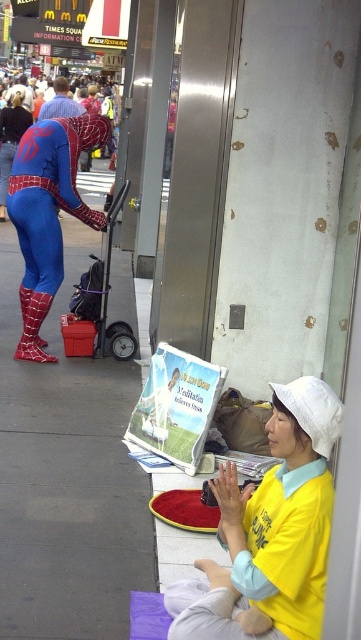
Question: Which object is positioned farthest from the blue spandex suit at left?

Choices:
 (A) matte paper comic book at lower center
 (B) yellow fabric shirt at lower right
 (C) shiny spandex suit at left

Answer: (B)

Question: Considering the relative positions of yellow fabric shirt at lower right and blue spandex suit at left in the image provided, where is yellow fabric shirt at lower right located with respect to blue spandex suit at left?

Choices:
 (A) above
 (B) below

Answer: (B)

Question: Which object is positioned closest to the blue spandex suit at left?

Choices:
 (A) shiny spandex suit at left
 (B) yellow fabric shirt at lower right
 (C) concrete sidewalk at lower left
 (D) matte paper comic book at lower center

Answer: (A)

Question: Where is matte paper comic book at lower center located in relation to blue spandex suit at left in the image?

Choices:
 (A) left
 (B) right

Answer: (B)

Question: Considering the relative positions of concrete sidewalk at lower left and blue spandex suit at left in the image provided, where is concrete sidewalk at lower left located with respect to blue spandex suit at left?

Choices:
 (A) below
 (B) above

Answer: (A)

Question: Which object is farther from the camera taking this photo?

Choices:
 (A) shiny spandex suit at left
 (B) yellow fabric shirt at lower right
 (C) concrete sidewalk at lower left
 (D) matte paper comic book at lower center

Answer: (A)